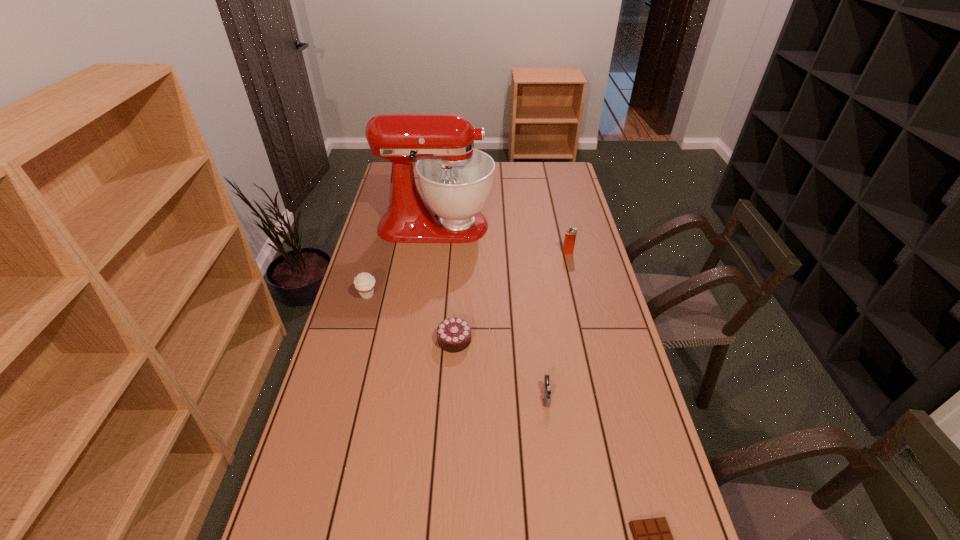
Find the location of a particular element. Image resolution: width=960 pixels, height=540 pixels. mixer is located at coordinates [x=455, y=179].

Find the location of a particular element. The width and height of the screenshot is (960, 540). the tallest object is located at coordinates (455, 179).

Find the location of a particular element. The image size is (960, 540). the farther igniter is located at coordinates (570, 235).

I want to click on the taller igniter, so click(x=570, y=235).

The image size is (960, 540). I want to click on the third farthest object, so [x=364, y=283].

The height and width of the screenshot is (540, 960). Identify the location of the shorter igniter. (548, 389).

The image size is (960, 540). I want to click on the fifth farthest object, so click(x=548, y=389).

This screenshot has width=960, height=540. Find the location of `chocolate cake`. chocolate cake is located at coordinates (453, 334).

This screenshot has width=960, height=540. I want to click on the third nearest object, so click(453, 334).

This screenshot has height=540, width=960. I want to click on vacant space located 0.280m at the attachment hub of the tallest object, so click(x=560, y=226).